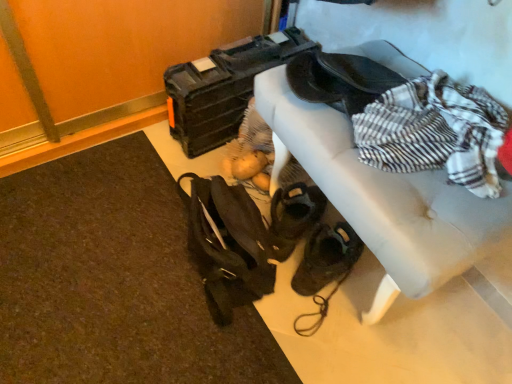
Question: From the image's perspective, does matte black toolbox at upper center appear higher than leather couch at upper right?

Choices:
 (A) no
 (B) yes

Answer: (B)

Question: Is leather couch at upper right located within matte black toolbox at upper center?

Choices:
 (A) yes
 (B) no

Answer: (B)

Question: Considering the relative sizes of matte black toolbox at upper center and leather couch at upper right in the image provided, is matte black toolbox at upper center bigger than leather couch at upper right?

Choices:
 (A) yes
 (B) no

Answer: (B)

Question: Does matte black toolbox at upper center have a greater height compared to leather couch at upper right?

Choices:
 (A) no
 (B) yes

Answer: (A)

Question: From a real-world perspective, is matte black toolbox at upper center positioned under leather couch at upper right based on gravity?

Choices:
 (A) yes
 (B) no

Answer: (A)

Question: Is the surface of matte black toolbox at upper center in direct contact with leather couch at upper right?

Choices:
 (A) no
 (B) yes

Answer: (A)

Question: Is matte black toolbox at upper center next to dark brown leather messenger bag at lower center and touching it?

Choices:
 (A) yes
 (B) no

Answer: (B)

Question: Does matte black toolbox at upper center have a lesser width compared to dark brown leather messenger bag at lower center?

Choices:
 (A) yes
 (B) no

Answer: (B)

Question: From a real-world perspective, is matte black toolbox at upper center located beneath dark brown leather messenger bag at lower center?

Choices:
 (A) yes
 (B) no

Answer: (B)

Question: Considering the relative sizes of matte black toolbox at upper center and dark brown leather messenger bag at lower center in the image provided, is matte black toolbox at upper center taller than dark brown leather messenger bag at lower center?

Choices:
 (A) yes
 (B) no

Answer: (A)

Question: Does matte black toolbox at upper center have a larger size compared to dark brown leather messenger bag at lower center?

Choices:
 (A) yes
 (B) no

Answer: (A)

Question: Is matte black toolbox at upper center to the left of dark brown leather messenger bag at lower center from the viewer's perspective?

Choices:
 (A) yes
 (B) no

Answer: (B)

Question: Does leather couch at upper right appear on the left side of matte black toolbox at upper center?

Choices:
 (A) no
 (B) yes

Answer: (A)